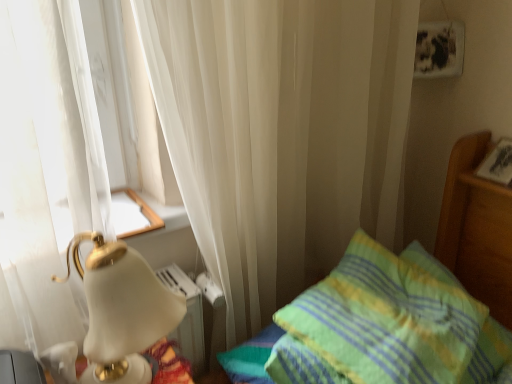
Question: Should I look upward or downward to see green/yellow striped pillow at right?

Choices:
 (A) down
 (B) up

Answer: (A)

Question: Is white glossy lamp at left surrounding green/yellow striped pillow at right?

Choices:
 (A) no
 (B) yes

Answer: (A)

Question: Are white glossy lamp at left and green/yellow striped pillow at right making contact?

Choices:
 (A) yes
 (B) no

Answer: (B)

Question: Is white glossy lamp at left turned away from green/yellow striped pillow at right?

Choices:
 (A) no
 (B) yes

Answer: (A)

Question: From a real-world perspective, is white glossy lamp at left over green/yellow striped pillow at right?

Choices:
 (A) yes
 (B) no

Answer: (A)

Question: Is white glossy lamp at left further to camera compared to green/yellow striped pillow at right?

Choices:
 (A) no
 (B) yes

Answer: (A)

Question: Is white glossy lamp at left at the right side of green/yellow striped pillow at right?

Choices:
 (A) yes
 (B) no

Answer: (B)

Question: Is green/yellow striped pillow at right positioned in front of white glossy lamp at left?

Choices:
 (A) yes
 (B) no

Answer: (B)

Question: From the image's perspective, is green/yellow striped pillow at right below white glossy lamp at left?

Choices:
 (A) yes
 (B) no

Answer: (A)

Question: Can you confirm if green/yellow striped pillow at right is smaller than white glossy lamp at left?

Choices:
 (A) no
 (B) yes

Answer: (A)

Question: Is the position of green/yellow striped pillow at right more distant than that of white glossy lamp at left?

Choices:
 (A) no
 (B) yes

Answer: (B)

Question: Is white glossy lamp at left inside green/yellow striped pillow at right?

Choices:
 (A) yes
 (B) no

Answer: (B)

Question: Can you confirm if green/yellow striped pillow at right is wider than white glossy lamp at left?

Choices:
 (A) no
 (B) yes

Answer: (B)

Question: Based on their positions, is white glossy lamp at left located to the left or right of green/yellow striped pillow at right?

Choices:
 (A) right
 (B) left

Answer: (B)